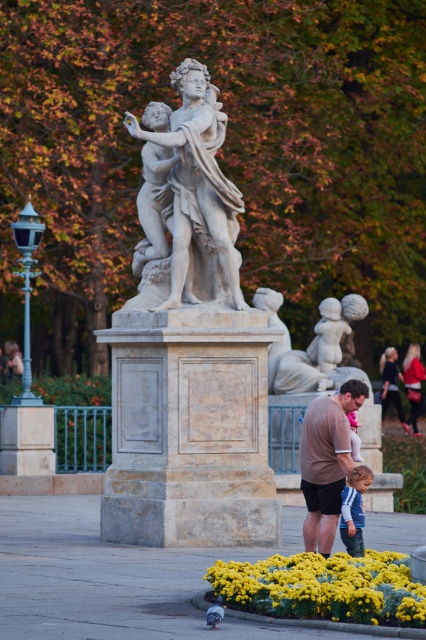
Does yellow matte flowers at lower center have a smaller size compared to blue striped shirt at lower center?

No, yellow matte flowers at lower center is not smaller than blue striped shirt at lower center.

Where is `yellow matte flowers at lower center`? This screenshot has width=426, height=640. yellow matte flowers at lower center is located at coordinates (324, 588).

The width and height of the screenshot is (426, 640). Find the location of `yellow matte flowers at lower center`. yellow matte flowers at lower center is located at coordinates (324, 588).

Who is positioned more to the right, matte red coat at lower right or dark blue fabric dress at lower right?

From the viewer's perspective, matte red coat at lower right appears more on the right side.

Does matte red coat at lower right have a greater height compared to dark blue fabric dress at lower right?

Yes.

Image resolution: width=426 pixels, height=640 pixels. I want to click on matte red coat at lower right, so click(x=414, y=385).

Measure the distance between white marble statue at center and matte red coat at lower right.

white marble statue at center and matte red coat at lower right are 55.94 meters apart.

Which of these two, white marble statue at center or matte red coat at lower right, stands shorter?

Standing shorter between the two is matte red coat at lower right.

Which is in front, point (226, 300) or point (408, 388)?

Point (226, 300)

At what (x,y) coordinates should I click in order to perform the action: click on white marble statue at center. Please return your answer as a coordinate pair (x, y). Image resolution: width=426 pixels, height=640 pixels. Looking at the image, I should click on (187, 196).